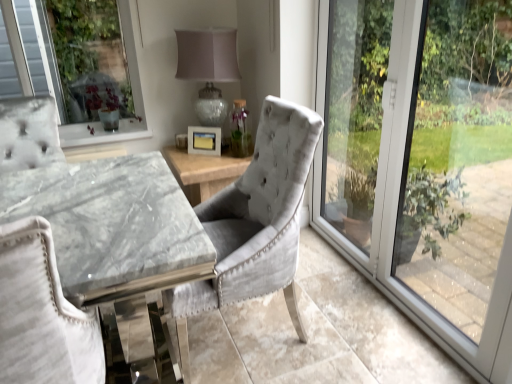
Question: Does velvet grey chair at center, placed as the 2th chair when sorted from left to right, lie behind matte glass table lamp at center?

Choices:
 (A) no
 (B) yes

Answer: (A)

Question: Can we say velvet grey chair at center, arranged as the first chair when viewed from the right, lies outside matte glass table lamp at center?

Choices:
 (A) yes
 (B) no

Answer: (A)

Question: Is velvet grey chair at center, placed as the 2th chair when sorted from left to right, looking in the opposite direction of matte glass table lamp at center?

Choices:
 (A) no
 (B) yes

Answer: (A)

Question: Can you confirm if velvet grey chair at center, placed as the 2th chair when sorted from left to right, is thinner than matte glass table lamp at center?

Choices:
 (A) no
 (B) yes

Answer: (A)

Question: Does velvet grey chair at center, placed as the 2th chair when sorted from left to right, have a greater width compared to matte glass table lamp at center?

Choices:
 (A) yes
 (B) no

Answer: (A)

Question: Is point (66, 337) closer or farther from the camera than point (417, 281)?

Choices:
 (A) closer
 (B) farther

Answer: (A)

Question: From the image's perspective, is white fabric chair at left, positioned as the 1th chair in left-to-right order, above or below transparent glass window at right?

Choices:
 (A) below
 (B) above

Answer: (A)

Question: Do you think white fabric chair at left, which appears as the second chair when viewed from the right, is within transparent glass window at right, or outside of it?

Choices:
 (A) inside
 (B) outside

Answer: (B)

Question: Is white fabric chair at left, which appears as the second chair when viewed from the right, wider or thinner than transparent glass window at right?

Choices:
 (A) thin
 (B) wide

Answer: (B)

Question: Choose the correct answer: Is velvet grey chair at center, arranged as the first chair when viewed from the right, inside transparent glass window at right or outside it?

Choices:
 (A) inside
 (B) outside

Answer: (B)

Question: In terms of size, does velvet grey chair at center, arranged as the first chair when viewed from the right, appear bigger or smaller than transparent glass window at right?

Choices:
 (A) small
 (B) big

Answer: (B)

Question: Is point (229, 274) positioned closer to the camera than point (478, 150)?

Choices:
 (A) closer
 (B) farther

Answer: (A)

Question: From the image's perspective, is velvet grey chair at center, arranged as the first chair when viewed from the right, above or below transparent glass window at right?

Choices:
 (A) above
 (B) below

Answer: (B)

Question: Considering the positions of matte glass table lamp at center and white matte picture frame at center in the image, is matte glass table lamp at center bigger or smaller than white matte picture frame at center?

Choices:
 (A) small
 (B) big

Answer: (B)

Question: Is matte glass table lamp at center to the left or to the right of white matte picture frame at center in the image?

Choices:
 (A) right
 (B) left

Answer: (A)